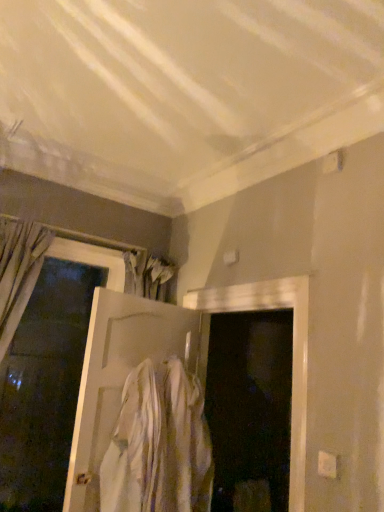
Question: Is white cotton shirt at center closer to camera compared to white matte door at left, arranged as the second door when viewed from the right?

Choices:
 (A) yes
 (B) no

Answer: (A)

Question: From the image's perspective, is white cotton shirt at center under white matte door at left, which ranks as the first door in left-to-right order?

Choices:
 (A) yes
 (B) no

Answer: (A)

Question: From the image's perspective, is white cotton shirt at center over white matte door at left, arranged as the second door when viewed from the right?

Choices:
 (A) no
 (B) yes

Answer: (A)

Question: Does white cotton shirt at center have a lesser width compared to white matte door at left, arranged as the second door when viewed from the right?

Choices:
 (A) no
 (B) yes

Answer: (A)

Question: Is white cotton shirt at center far away from white matte door at left, arranged as the second door when viewed from the right?

Choices:
 (A) yes
 (B) no

Answer: (A)

Question: Considering the relative sizes of white cotton shirt at center and white matte door at left, which ranks as the first door in left-to-right order, in the image provided, is white cotton shirt at center smaller than white matte door at left, which ranks as the first door in left-to-right order,?

Choices:
 (A) yes
 (B) no

Answer: (A)

Question: Considering the relative sizes of white matte door at center, positioned as the second door in left-to-right order, and white matte door at left, arranged as the second door when viewed from the right, in the image provided, is white matte door at center, positioned as the second door in left-to-right order, bigger than white matte door at left, arranged as the second door when viewed from the right,?

Choices:
 (A) yes
 (B) no

Answer: (B)

Question: Could you tell me if white matte door at center, the first door when ordered from right to left, is facing white matte door at left, which ranks as the first door in left-to-right order?

Choices:
 (A) no
 (B) yes

Answer: (B)

Question: From the image's perspective, is white matte door at center, the first door when ordered from right to left, over white matte door at left, which ranks as the first door in left-to-right order?

Choices:
 (A) no
 (B) yes

Answer: (A)

Question: Would you consider white matte door at center, positioned as the second door in left-to-right order, to be distant from white matte door at left, arranged as the second door when viewed from the right?

Choices:
 (A) no
 (B) yes

Answer: (A)

Question: Is white matte door at center, the first door when ordered from right to left, outside white matte door at left, which ranks as the first door in left-to-right order?

Choices:
 (A) yes
 (B) no

Answer: (A)

Question: Can you confirm if white matte door at center, positioned as the second door in left-to-right order, is smaller than white matte door at left, which ranks as the first door in left-to-right order?

Choices:
 (A) no
 (B) yes

Answer: (B)

Question: Is white cotton shirt at center next to white matte door at center, positioned as the second door in left-to-right order?

Choices:
 (A) yes
 (B) no

Answer: (B)